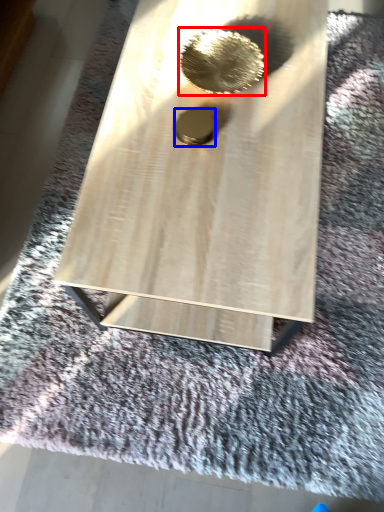
Question: Among these objects, which one is farthest to the camera, hole (highlighted by a red box) or hole (highlighted by a blue box)?

Choices:
 (A) hole
 (B) hole

Answer: (A)